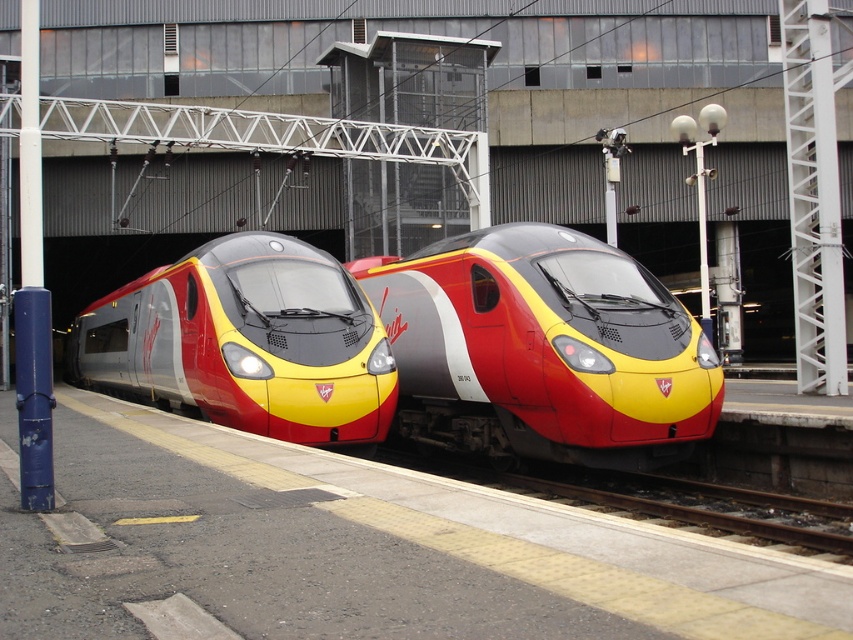
Question: Does matte red and yellow train at center appear under matte metallic train at center?

Choices:
 (A) yes
 (B) no

Answer: (A)

Question: Considering the relative positions of matte red and yellow train at center and matte metallic train at center in the image provided, where is matte red and yellow train at center located with respect to matte metallic train at center?

Choices:
 (A) right
 (B) left

Answer: (A)

Question: Which point is closer to the camera?

Choices:
 (A) matte red and yellow train at center
 (B) matte metallic train at center

Answer: (A)

Question: Observing the image, what is the correct spatial positioning of matte red and yellow train at center in reference to matte metallic train at center?

Choices:
 (A) above
 (B) below

Answer: (B)

Question: Among these points, which one is farthest from the camera?

Choices:
 (A) (601, 284)
 (B) (180, 336)

Answer: (B)

Question: Which point appears farthest from the camera in this image?

Choices:
 (A) (485, 422)
 (B) (306, 385)

Answer: (A)